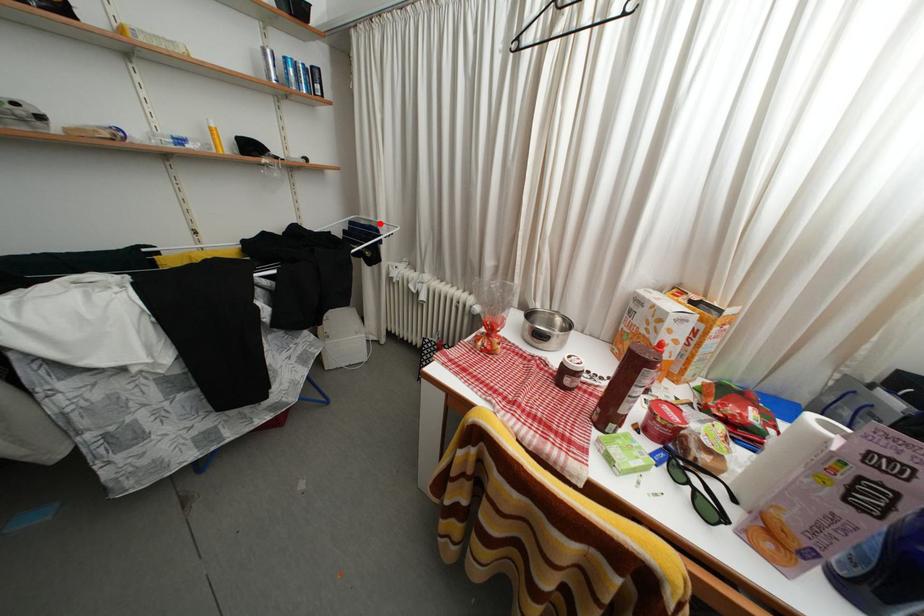
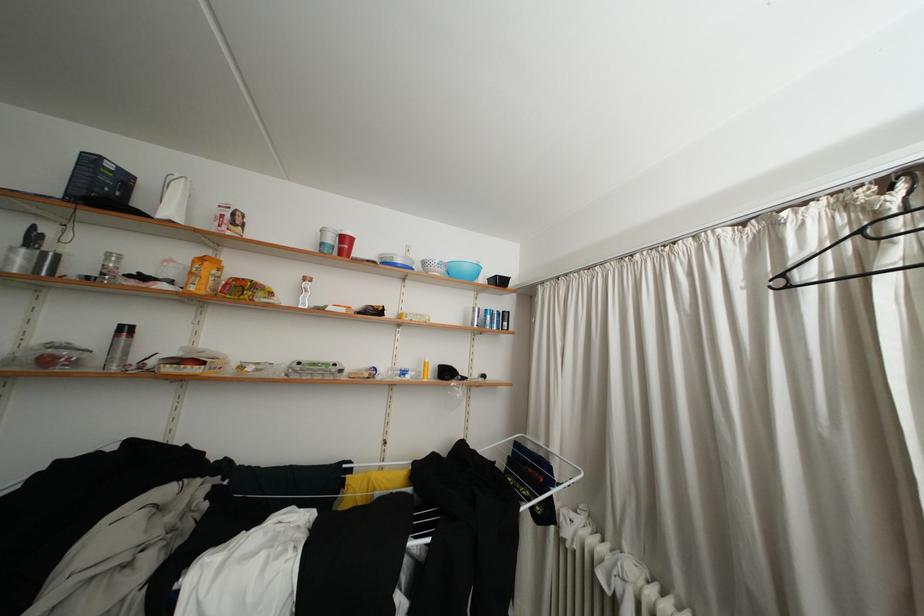
Locate, in the second image, the point that corresponds to the highlighted location in the first image.

(550, 448)